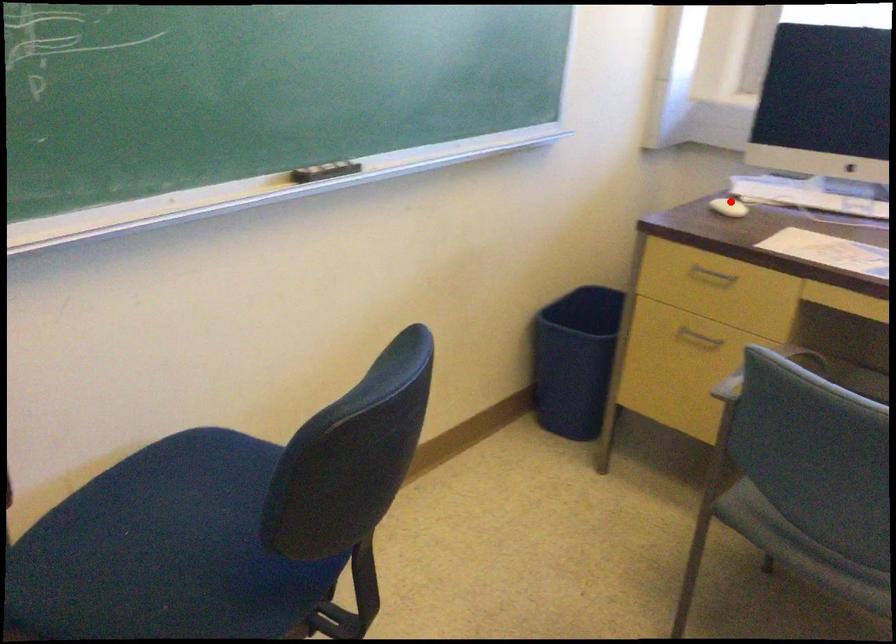
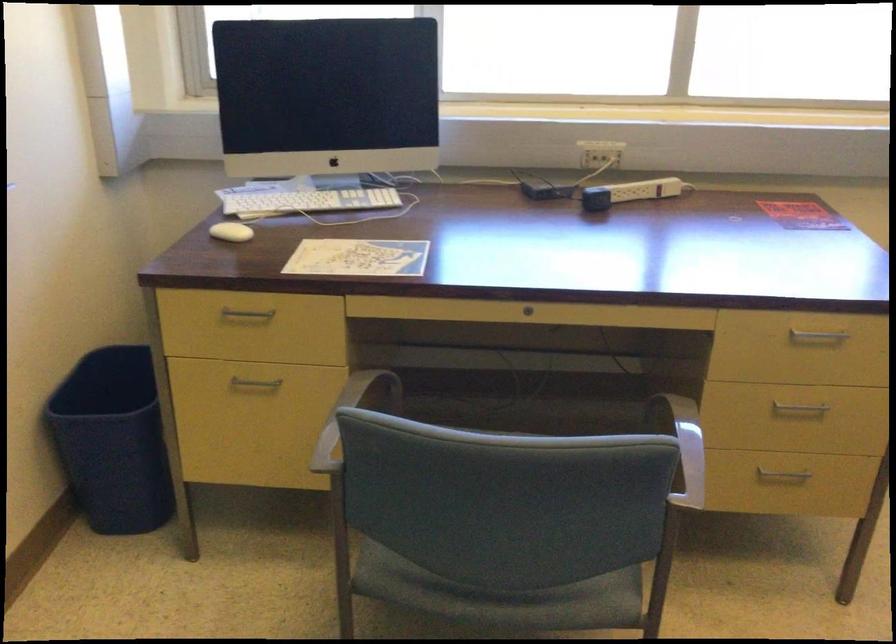
Find the pixel in the second image that matches the highlighted location in the first image.

(230, 232)